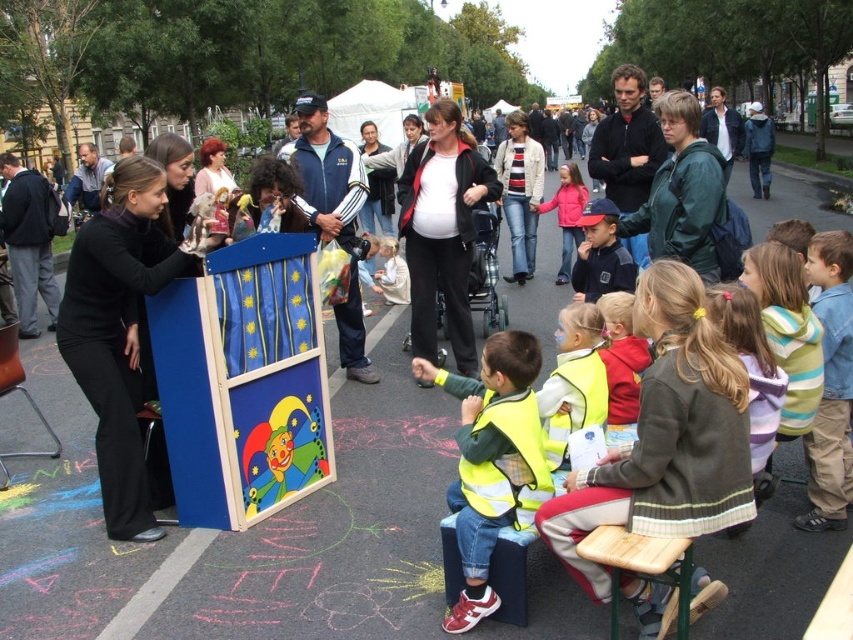
Is hi-viz yellow vest at center further to camera compared to blue fabric cap at center?

No, hi-viz yellow vest at center is in front of blue fabric cap at center.

Which is behind, point (482, 548) or point (624, 262)?

The point (624, 262) is more distant.

Between point (503, 356) and point (579, 298), which one is positioned behind?

Point (579, 298)

At what (x,y) coordinates should I click in order to perform the action: click on hi-viz yellow vest at center. Please return your answer as a coordinate pair (x, y). This screenshot has height=640, width=853. Looking at the image, I should click on (492, 461).

Is wooden puppet show at center positioned at the back of hi-viz yellow vest at center?

Yes.

Between wooden puppet show at center and hi-viz yellow vest at center, which one is positioned higher?

Positioned higher is wooden puppet show at center.

Who is more distant from viewer, (x=241, y=461) or (x=548, y=486)?

Positioned behind is point (x=241, y=461).

The width and height of the screenshot is (853, 640). In order to click on wooden puppet show at center in this screenshot , I will do `click(242, 381)`.

Is point (563, 544) more distant than point (363, 182)?

No.

Is yellow high-visibility vest at center positioned before blue painted wooden podium at center?

Yes.

Is point (733, 508) less distant than point (352, 328)?

That is True.

This screenshot has height=640, width=853. What are the coordinates of `yellow high-visibility vest at center` in the screenshot? It's located at (665, 436).